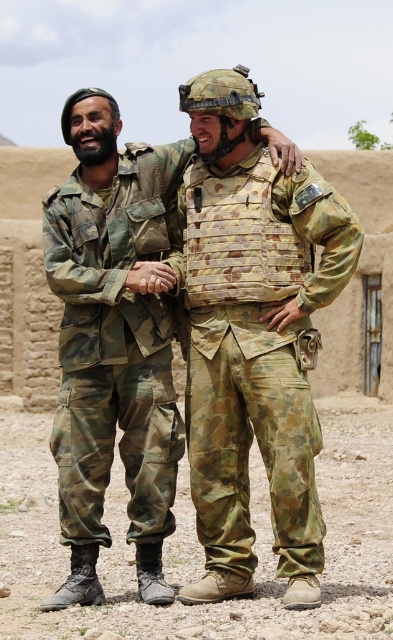
Question: Is camouflage uniform at center thinner than camouflage fabric vest at center?

Choices:
 (A) no
 (B) yes

Answer: (A)

Question: Which object is farther from the camera taking this photo?

Choices:
 (A) camouflage uniform at center
 (B) camouflage fabric pants at left

Answer: (B)

Question: Is camouflage fabric vest at center to the right of camouflage fabric pants at left from the viewer's perspective?

Choices:
 (A) yes
 (B) no

Answer: (A)

Question: Which object appears farthest from the camera in this image?

Choices:
 (A) camouflage fabric pants at left
 (B) camouflage fabric vest at center

Answer: (A)

Question: Can you confirm if camouflage uniform at center is positioned to the right of camouflage fabric pants at left?

Choices:
 (A) yes
 (B) no

Answer: (A)

Question: Considering the real-world distances, which object is closest to the camouflage fabric pants at left?

Choices:
 (A) camouflage fabric vest at center
 (B) camouflage uniform at center

Answer: (B)